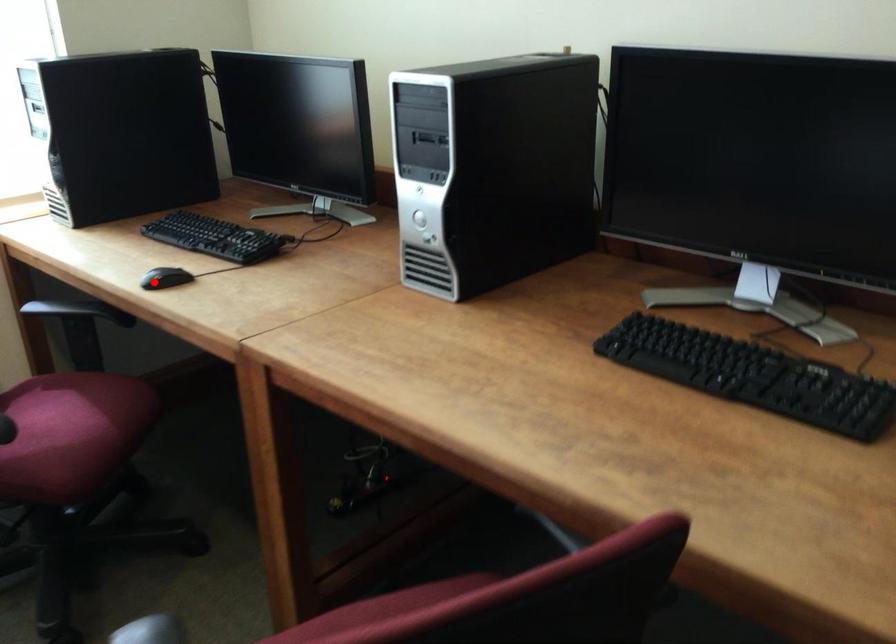
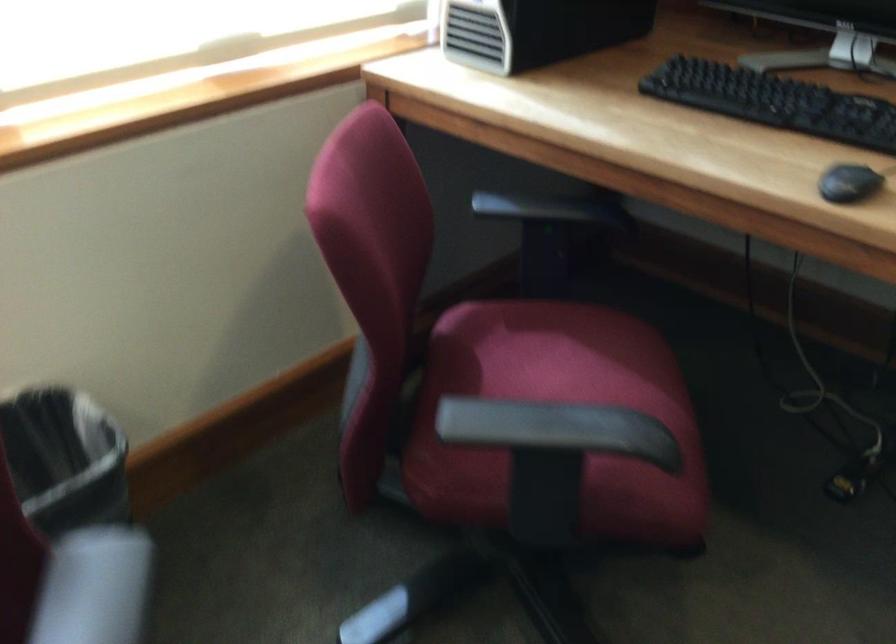
Question: I am providing you with two images of the same scene from different viewpoints. Given a red point in image1, look at the same physical point in image2. Is it:

Choices:
 (A) Closer to the viewpoint
 (B) Farther from the viewpoint

Answer: (A)